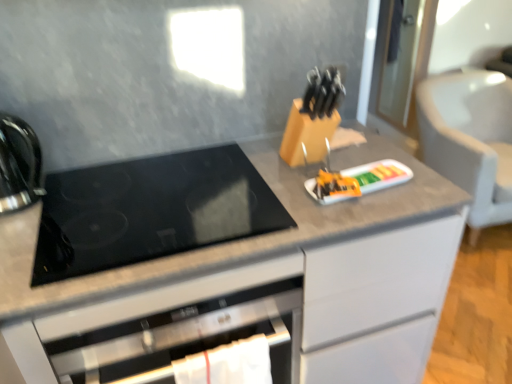
Question: Is black glass cooktop at center positioned far away from shiny black kettle at left?

Choices:
 (A) no
 (B) yes

Answer: (A)

Question: From a real-world perspective, is black glass cooktop at center positioned over shiny black kettle at left based on gravity?

Choices:
 (A) no
 (B) yes

Answer: (A)

Question: Considering the relative sizes of black glass cooktop at center and shiny black kettle at left in the image provided, is black glass cooktop at center thinner than shiny black kettle at left?

Choices:
 (A) yes
 (B) no

Answer: (B)

Question: From the image's perspective, is black glass cooktop at center under shiny black kettle at left?

Choices:
 (A) yes
 (B) no

Answer: (A)

Question: Is black glass cooktop at center positioned with its back to shiny black kettle at left?

Choices:
 (A) yes
 (B) no

Answer: (B)

Question: Is wooden cabinet at center bigger or smaller than shiny black kettle at left?

Choices:
 (A) big
 (B) small

Answer: (A)

Question: In terms of height, does wooden cabinet at center look taller or shorter compared to shiny black kettle at left?

Choices:
 (A) tall
 (B) short

Answer: (A)

Question: Would you say wooden cabinet at center is to the left or to the right of shiny black kettle at left in the picture?

Choices:
 (A) right
 (B) left

Answer: (A)

Question: Looking at their shapes, would you say wooden cabinet at center is wider or thinner than shiny black kettle at left?

Choices:
 (A) thin
 (B) wide

Answer: (B)

Question: From their relative heights in the image, would you say orange plastic tray at center is taller or shorter than wooden cabinet at center?

Choices:
 (A) short
 (B) tall

Answer: (A)

Question: In terms of width, does orange plastic tray at center look wider or thinner when compared to wooden cabinet at center?

Choices:
 (A) wide
 (B) thin

Answer: (B)

Question: In the image, is orange plastic tray at center on the left side or the right side of wooden cabinet at center?

Choices:
 (A) left
 (B) right

Answer: (B)

Question: Based on their sizes in the image, would you say orange plastic tray at center is bigger or smaller than wooden cabinet at center?

Choices:
 (A) big
 (B) small

Answer: (B)

Question: Is orange plastic tray at center in front of or behind shiny black kettle at left in the image?

Choices:
 (A) front
 (B) behind

Answer: (B)

Question: Is orange plastic tray at center situated inside shiny black kettle at left or outside?

Choices:
 (A) inside
 (B) outside

Answer: (B)